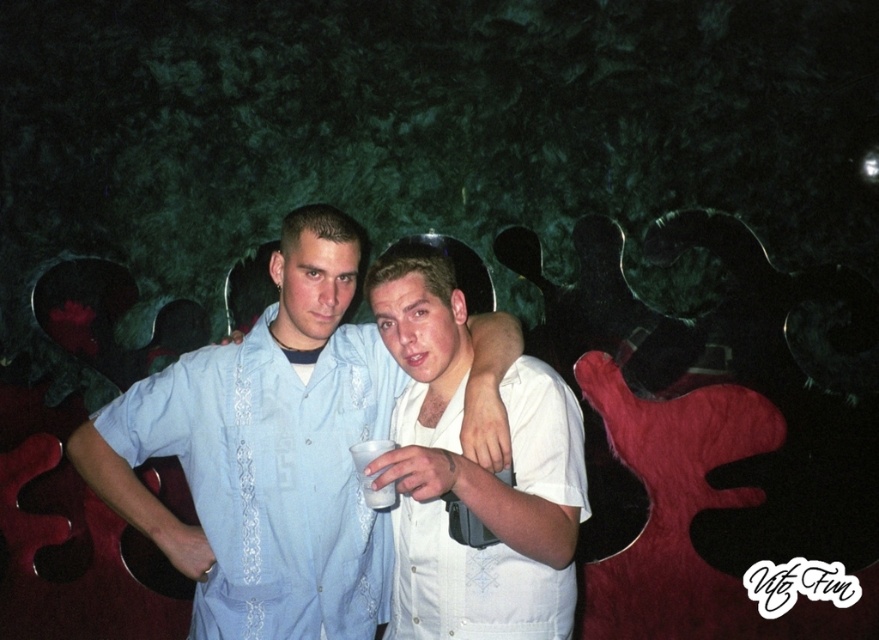
Looking at this image, based on the coordinates provided, which object is located at point (265, 452) in the image?

A: The light blue embroidered shirt at center is located at point (265, 452).

You are a photographer setting up for a group photo. You need to ensure that both the light blue embroidered shirt at center and the white cotton shirt at center are visible in the frame. Given their sizes, which shirt might require more space to accommodate its width?

The light blue embroidered shirt at center has a larger width than the white cotton shirt at center, so it might require more space to accommodate its width.

In the scene shown: You are standing in front of the two people in the image. Which person is closer to you, the one wearing the light blue embroidered shirt at center or the one in the white cotton shirt at center?

The light blue embroidered shirt at center is closer to you than the white cotton shirt at center because it is positioned further to the viewer.